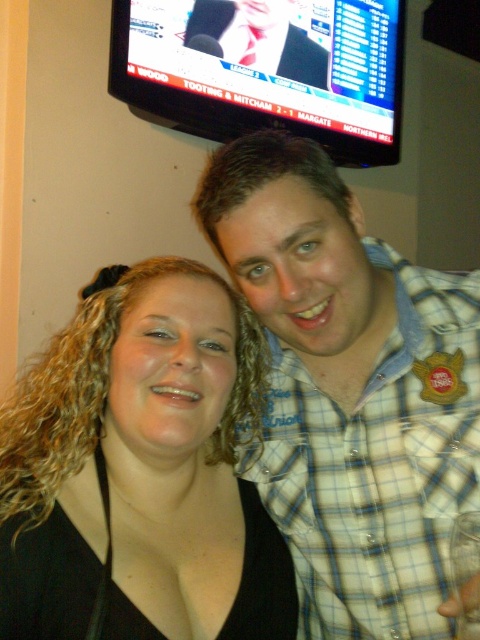
You are at a conference and need to take a photo of the blue plaid shirt at center and the matte black tie at upper center. Can you see both objects clearly in the photo without moving your camera?

The blue plaid shirt at center is in front of the matte black tie at upper center, so the blue plaid shirt at center may block the view of the matte black tie at upper center in the photo.

You are a photographer at a conference and need to adjust the camera focus. The blue plaid shirt at center and the black matte hair at center are both in the frame. Can you focus on both subjects simultaneously if the camera has a depth of field that can cover 6 inches?

The blue plaid shirt at center is 5.65 inches away from black matte hair at center. Since the distance between them is less than 6 inches, the camera can focus on both subjects simultaneously.

You are at a conference and need to introduce yourself to the person wearing the blue plaid shirt at center and the person with black matte hair at center. Who should you approach first if you want to greet the person on the right side?

The blue plaid shirt at center is positioned on the right side of black matte hair at center, so you should approach the blue plaid shirt at center first since it is on the right side.